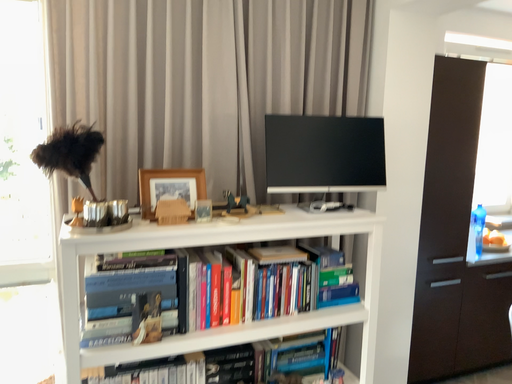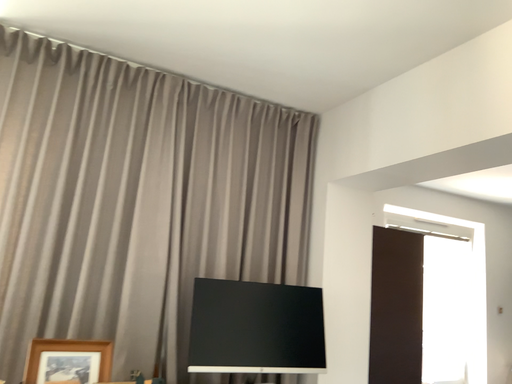
Question: How did the camera likely rotate when shooting the video?

Choices:
 (A) rotated downward
 (B) rotated upward

Answer: (B)